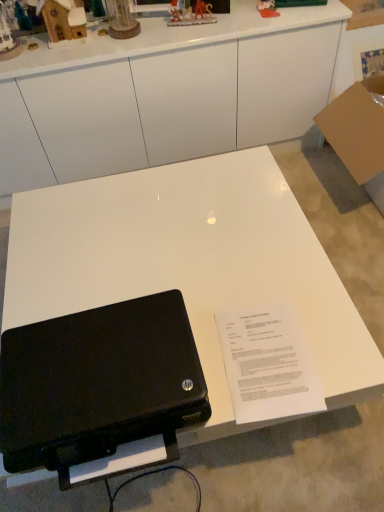
You are a GUI agent. You are given a task and a screenshot of the screen. Output one action in this format:
    pyautogui.click(x=<x>, y=<y>)
    Task: Click on the empty space that is to the right of black matte laptop at lower left
    This screenshot has height=512, width=384.
    Given the screenshot: What is the action you would take?
    pyautogui.click(x=256, y=343)